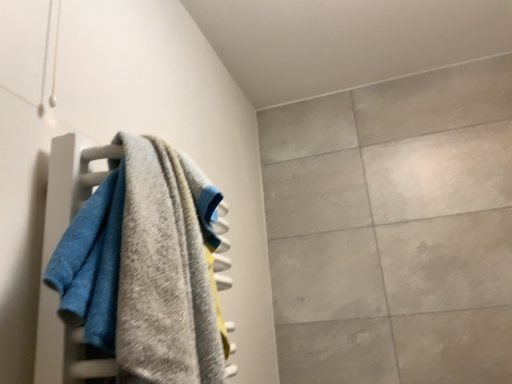
The height and width of the screenshot is (384, 512). Describe the element at coordinates (145, 267) in the screenshot. I see `textured gray towel at left` at that location.

Image resolution: width=512 pixels, height=384 pixels. Identify the location of textured gray towel at left. (145, 267).

This screenshot has width=512, height=384. Find the location of `textured gray towel at left`. textured gray towel at left is located at coordinates (145, 267).